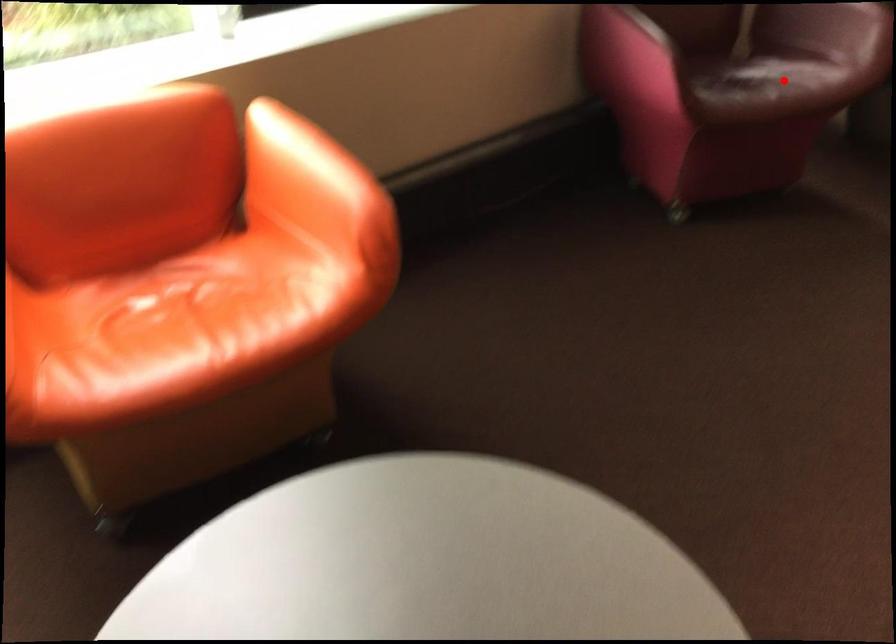
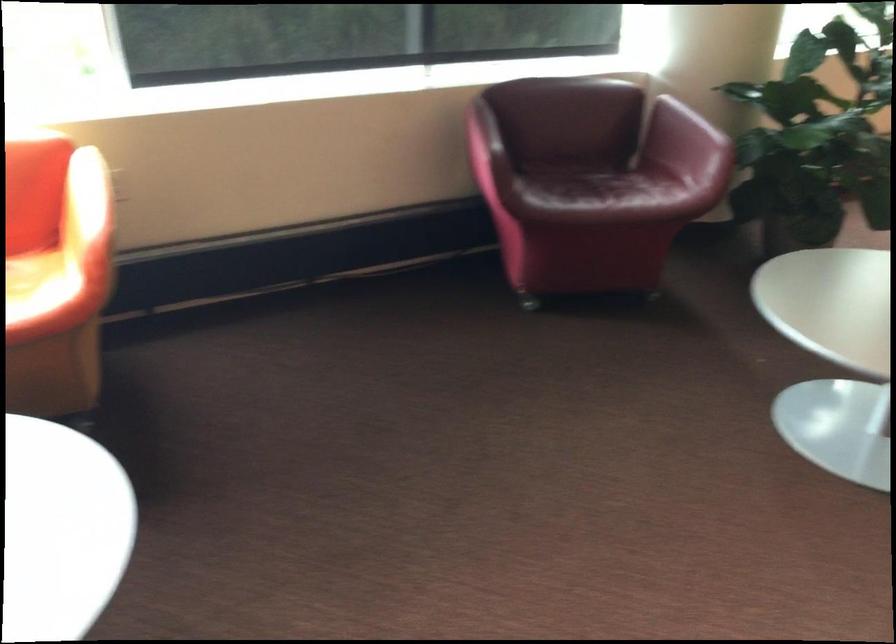
Find the pixel in the second image that matches the highlighted location in the first image.

(608, 194)